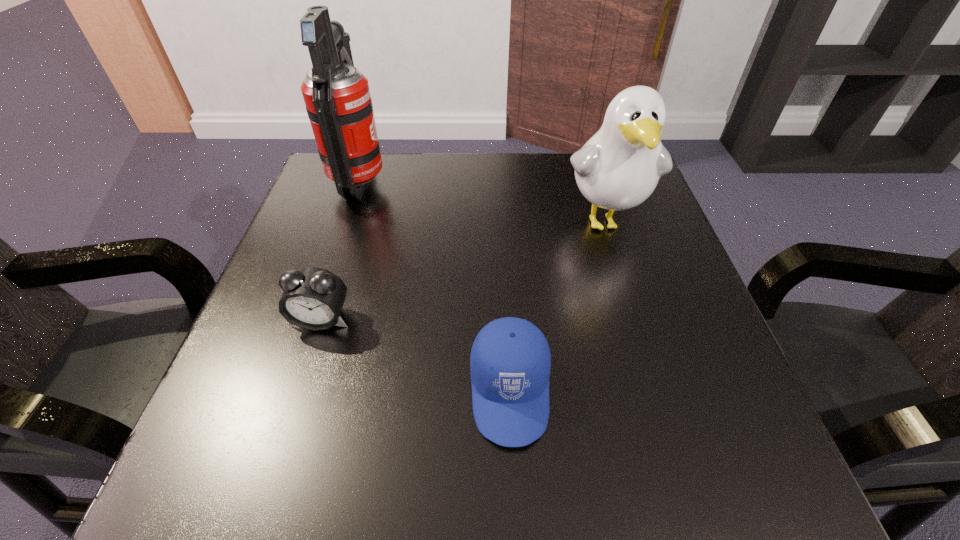
The height and width of the screenshot is (540, 960). Identify the location of the tallest object. (337, 97).

You are a GUI agent. You are given a task and a screenshot of the screen. Output one action in this format:
    pyautogui.click(x=<x>, y=<y>)
    Task: Click on the rightmost object
    This screenshot has width=960, height=540.
    Given the screenshot: What is the action you would take?
    pyautogui.click(x=618, y=168)

This screenshot has width=960, height=540. I want to click on the second tallest object, so click(x=618, y=168).

The width and height of the screenshot is (960, 540). Find the location of `the third farthest object`. the third farthest object is located at coordinates (313, 298).

Find the location of a particular element. The width and height of the screenshot is (960, 540). cap is located at coordinates (510, 361).

You are a GUI agent. You are given a task and a screenshot of the screen. Output one action in this format:
    pyautogui.click(x=<x>, y=<y>)
    Task: Click on the third object from left to right
    The width and height of the screenshot is (960, 540).
    Given the screenshot: What is the action you would take?
    pyautogui.click(x=510, y=361)

What are the coordinates of `vacant region located on the front label side of the tallest object` in the screenshot? It's located at (491, 183).

Where is `free location located 0.260m on the beak of the gull`? This screenshot has height=540, width=960. free location located 0.260m on the beak of the gull is located at coordinates (649, 365).

Where is `free space located on the front side of the alarm clock`? free space located on the front side of the alarm clock is located at coordinates (285, 432).

The width and height of the screenshot is (960, 540). Identify the location of fire extinguisher present at the far edge. (337, 97).